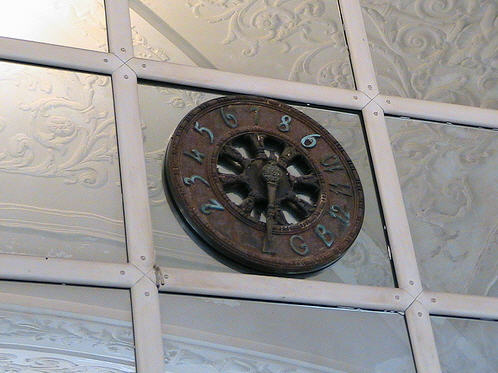
Locate an element on the screen. ceiling design is located at coordinates point(80,142), point(277,30), point(440,171).